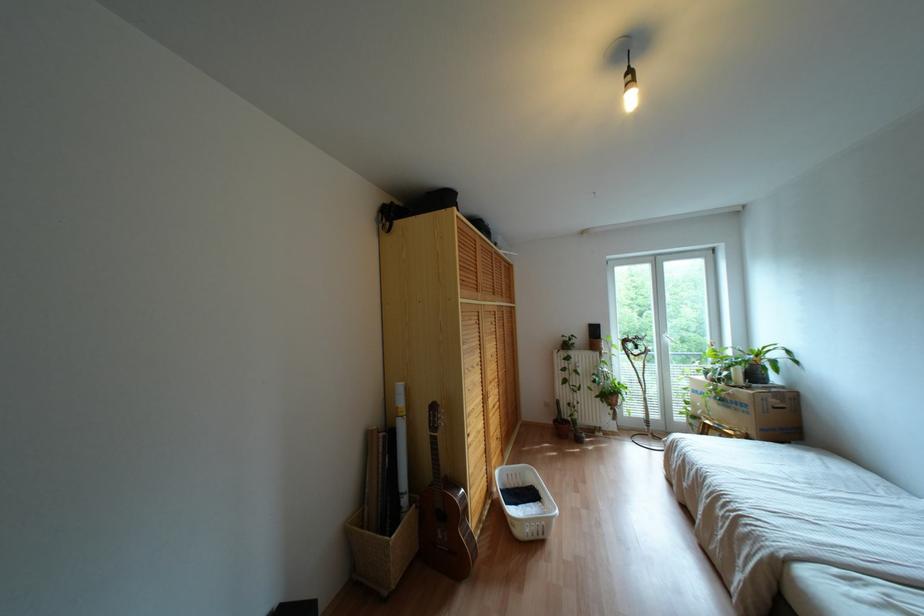
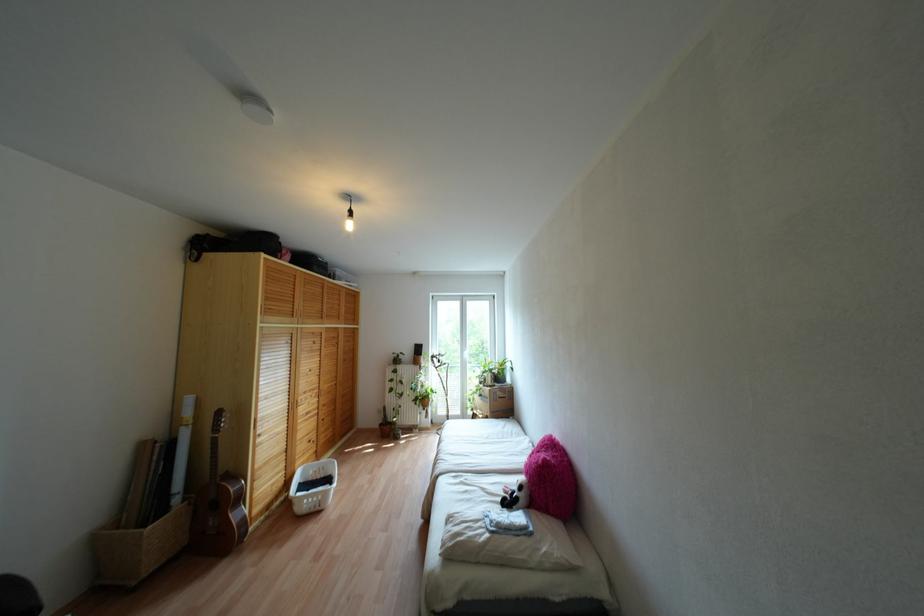
In the second image, find the point that corresponds to pixel 618 383 in the first image.

(431, 389)